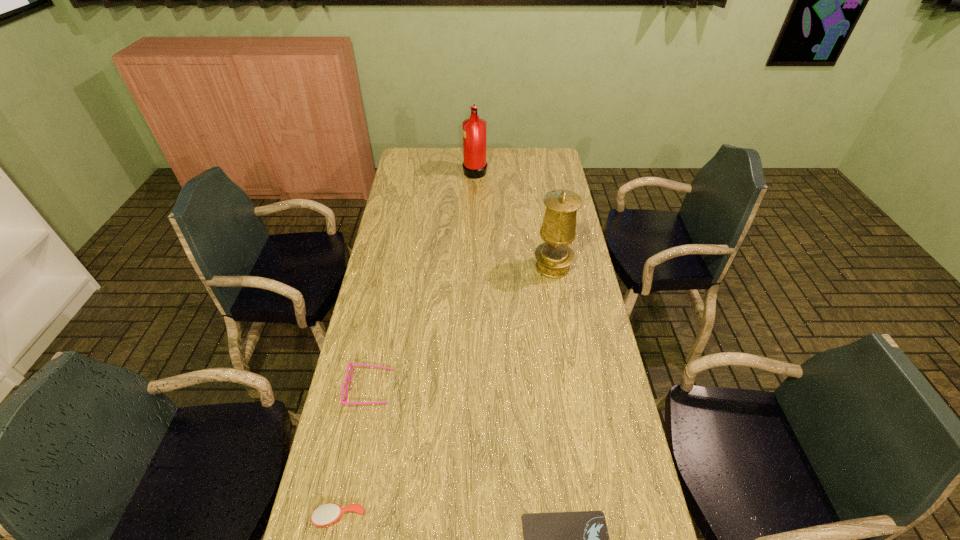
Where is `fire extinguisher`? The image size is (960, 540). fire extinguisher is located at coordinates (474, 128).

What are the coordinates of `the third object from right to left` in the screenshot? It's located at (474, 128).

I want to click on oil lamp, so click(554, 256).

Where is `the third tallest object`? the third tallest object is located at coordinates (350, 364).

Identify the location of the third nearest object. (350, 364).

Where is `hairbrush`? This screenshot has width=960, height=540. hairbrush is located at coordinates (327, 514).

Locate an element on the screen. vacant space located 0.130m at the spray nozzle of the third object from left to right is located at coordinates click(514, 170).

Where is `free spot located on the front of the oil lamp`? This screenshot has width=960, height=540. free spot located on the front of the oil lamp is located at coordinates (562, 320).

The width and height of the screenshot is (960, 540). I want to click on free point located 0.310m on the arms of the spectacles, so click(x=495, y=388).

Image resolution: width=960 pixels, height=540 pixels. Identify the location of free space located 0.340m on the right of the hairbrush. (505, 517).